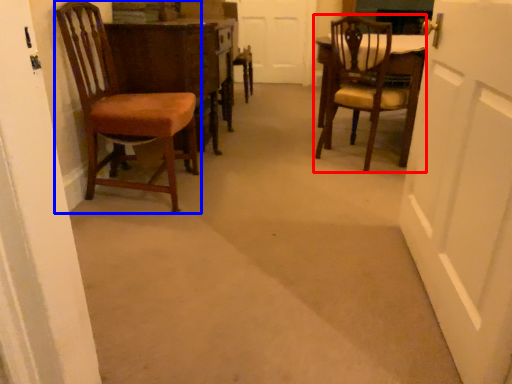
Question: Which object is closer to the camera taking this photo, chair (highlighted by a red box) or chair (highlighted by a blue box)?

Choices:
 (A) chair
 (B) chair

Answer: (B)